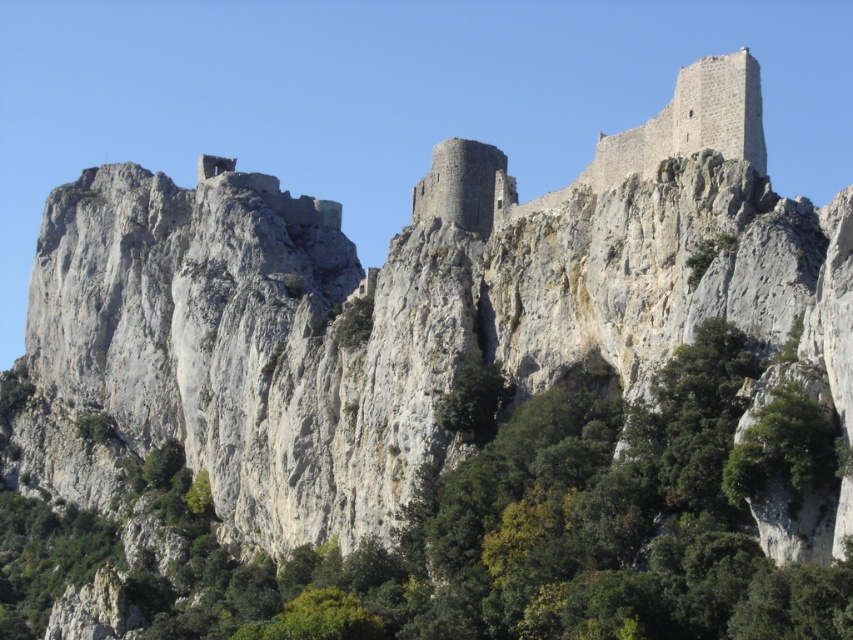
Who is lower down, green leafy tree at center or gray stone castle at upper right?

green leafy tree at center is below.

Which is in front, point (755, 573) or point (653, 120)?

Point (755, 573) is more forward.

Where is `green leafy tree at center`? green leafy tree at center is located at coordinates (543, 522).